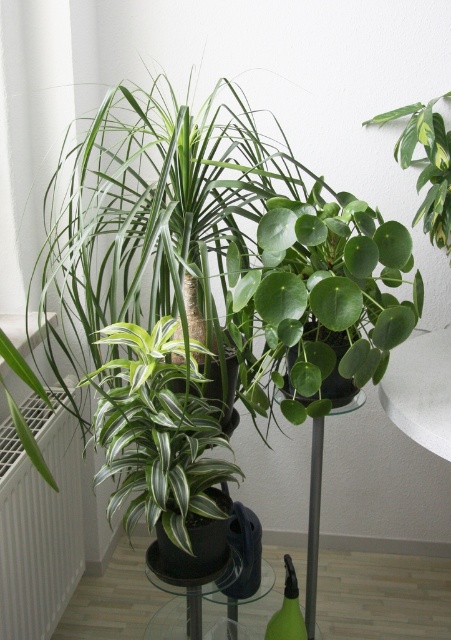
Is point (82, 564) farther from camera compared to point (435, 220)?

Yes, point (82, 564) is behind point (435, 220).

What do you see at coordinates (38, 522) in the screenshot?
I see `white metallic radiator at lower left` at bounding box center [38, 522].

This screenshot has width=451, height=640. Identify the location of white metallic radiator at lower left. (38, 522).

Who is more forward, (69, 454) or (197, 582)?

Point (197, 582)

Which is more to the left, white metallic radiator at lower left or transparent glass table at lower center?

From the viewer's perspective, white metallic radiator at lower left appears more on the left side.

Is point (69, 490) positioned after point (161, 630)?

No, it is in front of (161, 630).

Where is `white metallic radiator at lower left`? The height and width of the screenshot is (640, 451). white metallic radiator at lower left is located at coordinates (38, 522).

Is point (180, 445) more distant than point (178, 604)?

No.

Who is positioned more to the left, green glossy leafy plant at center or transparent glass table at lower center?

green glossy leafy plant at center

Who is more forward, (123,420) or (230,604)?

Point (123,420) is more forward.

Where is `green glossy leafy plant at center`? Image resolution: width=451 pixels, height=640 pixels. green glossy leafy plant at center is located at coordinates (157, 432).